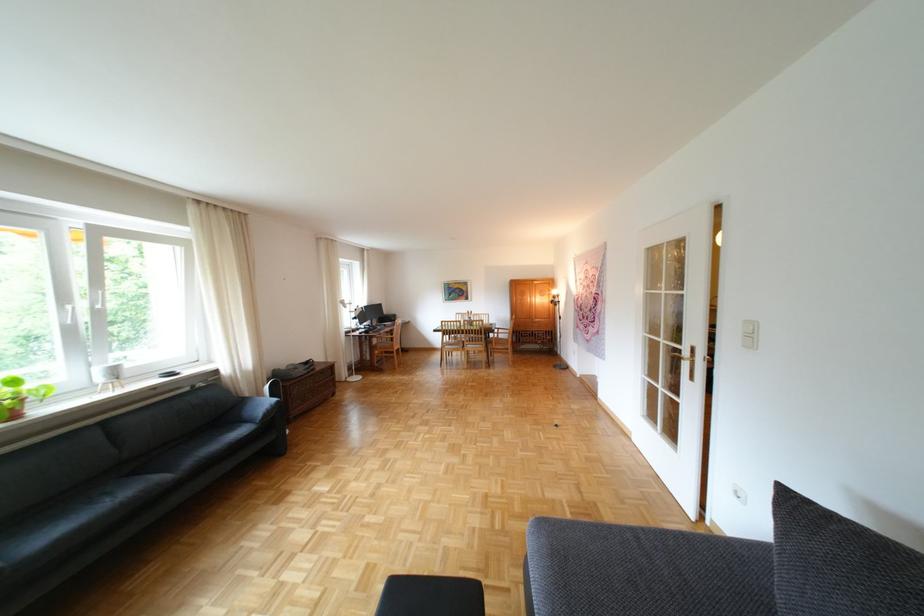
Find the location of a particular element. This screenshot has height=616, width=924. dark sofa sitting surface is located at coordinates (75, 513).